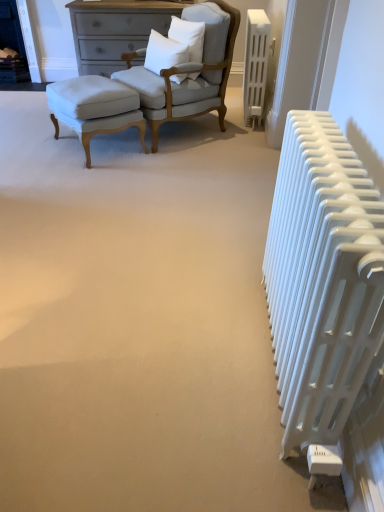
Question: From the image's perspective, would you say white soft pillow at center, which is the second pillow from right to left, is positioned over white plastic radiator at upper right, positioned as the first radiator in back-to-front order?

Choices:
 (A) no
 (B) yes

Answer: (A)

Question: From the image's perspective, is white soft pillow at center, which is the second pillow from right to left, beneath white plastic radiator at upper right, the 2th radiator when ordered from front to back?

Choices:
 (A) yes
 (B) no

Answer: (A)

Question: Is white soft pillow at center, which is the second pillow from right to left, behind white plastic radiator at upper right, positioned as the first radiator in back-to-front order?

Choices:
 (A) yes
 (B) no

Answer: (B)

Question: Does white soft pillow at center, which is the first pillow from left to right, appear on the left side of white plastic radiator at upper right, the 2th radiator when ordered from front to back?

Choices:
 (A) no
 (B) yes

Answer: (B)

Question: Can we say white soft pillow at center, which is the second pillow from right to left, lies outside white plastic radiator at upper right, the 2th radiator when ordered from front to back?

Choices:
 (A) yes
 (B) no

Answer: (A)

Question: From the image's perspective, is white plastic radiator at right, which is the second radiator from top to bottom, above or below white soft pillow at upper center, which is the 1th pillow in right-to-left order?

Choices:
 (A) above
 (B) below

Answer: (B)

Question: In terms of width, does white plastic radiator at right, which is the second radiator from top to bottom, look wider or thinner when compared to white soft pillow at upper center, which is the second pillow from left to right?

Choices:
 (A) wide
 (B) thin

Answer: (B)

Question: Does point (294, 455) appear closer or farther from the camera than point (190, 38)?

Choices:
 (A) closer
 (B) farther

Answer: (A)

Question: Would you say white plastic radiator at right, which ranks as the second radiator in back-to-front order, is to the left or to the right of white soft pillow at upper center, which is the 1th pillow in right-to-left order, in the picture?

Choices:
 (A) left
 (B) right

Answer: (B)

Question: Considering the positions of matte white fabric chair at upper left and light beige fabric stool at center-left in the image, is matte white fabric chair at upper left bigger or smaller than light beige fabric stool at center-left?

Choices:
 (A) small
 (B) big

Answer: (B)

Question: Would you say matte white fabric chair at upper left is inside or outside light beige fabric stool at center-left?

Choices:
 (A) outside
 (B) inside

Answer: (A)

Question: Is point (122, 56) positioned closer to the camera than point (122, 122)?

Choices:
 (A) farther
 (B) closer

Answer: (A)

Question: Based on their positions, is matte white fabric chair at upper left located to the left or right of light beige fabric stool at center-left?

Choices:
 (A) right
 (B) left

Answer: (A)

Question: Looking at the image, does white soft pillow at upper center, which is the 1th pillow in right-to-left order, seem bigger or smaller compared to matte white fabric chair at upper left?

Choices:
 (A) small
 (B) big

Answer: (A)

Question: Visually, is white soft pillow at upper center, which is the 1th pillow in right-to-left order, positioned to the left or to the right of matte white fabric chair at upper left?

Choices:
 (A) right
 (B) left

Answer: (A)